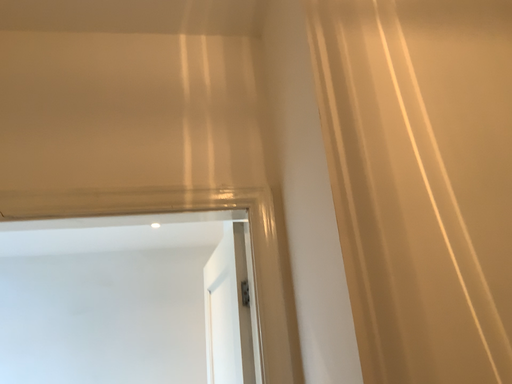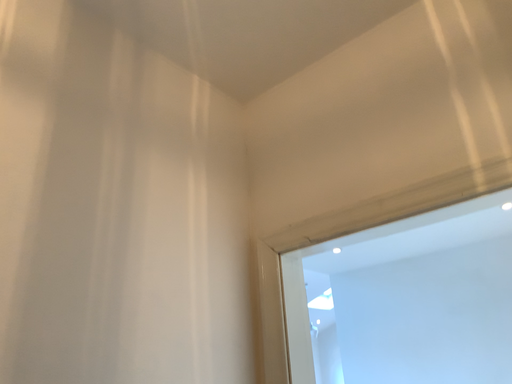
Question: Which way did the camera rotate in the video?

Choices:
 (A) rotated right
 (B) rotated left

Answer: (B)